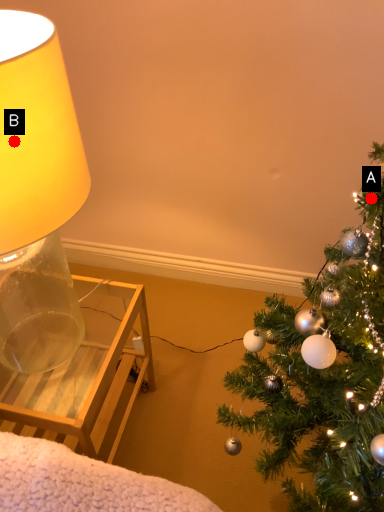
Question: Two points are circled on the image, labeled by A and B beside each circle. Which point is closer to the camera?

Choices:
 (A) A is closer
 (B) B is closer

Answer: (B)